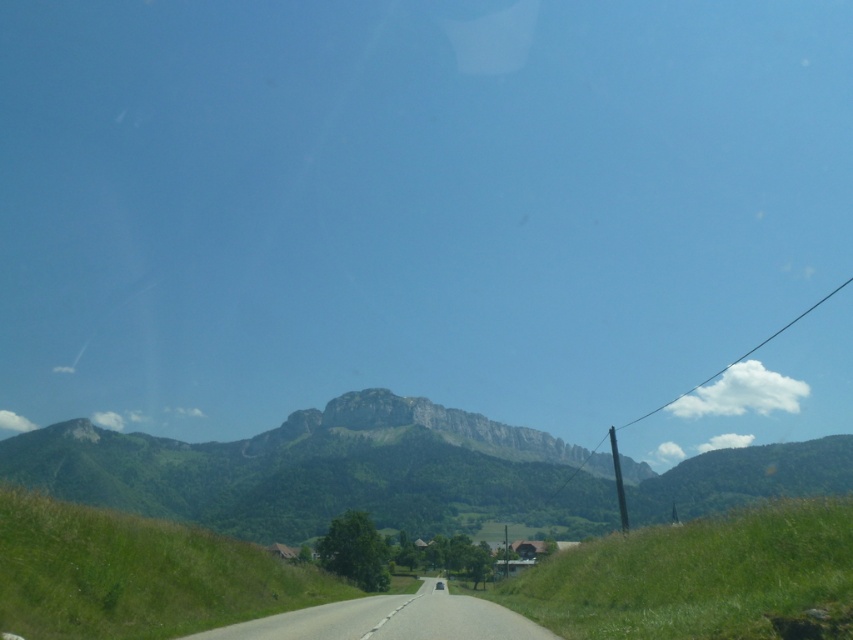
You are sitting inside the vehicle and want to know how far the point at coordinates (x=242, y=625) is from you. Can you determine the distance?

The point at coordinates (x=242, y=625) is 31.02 meters away from the viewer.

You are a passenger in the car and want to see the mountains in the distance. Which object, the gray asphalt road at center or the transparent glass car window at center, would allow you to have a better view of the mountains?

The transparent glass car window at center allows a better view of the mountains because the gray asphalt road at center is much taller and would block the view.